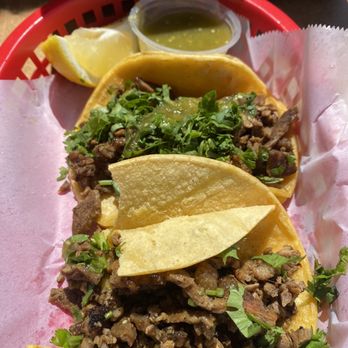
At what (x,y) coordinates should I click in order to perform the action: click on red tray. Please return your answer as a coordinate pair (x, y). Looking at the image, I should click on (26, 35).